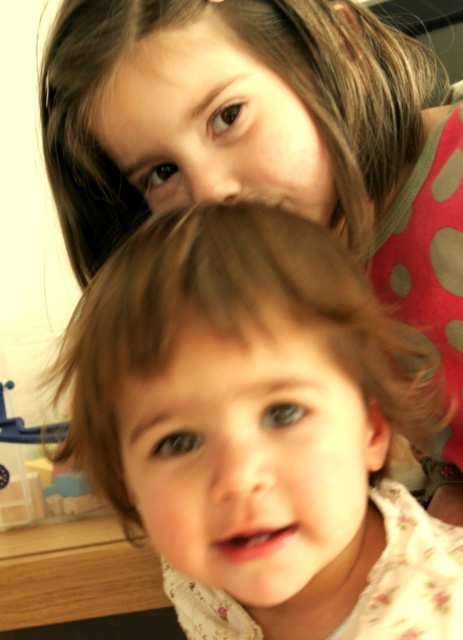
Can you confirm if fluffy brown hair at center is shorter than brown smooth hair at upper center?

Correct, fluffy brown hair at center is not as tall as brown smooth hair at upper center.

Can you confirm if fluffy brown hair at center is positioned above brown smooth hair at upper center?

No.

What do you see at coordinates (258, 429) in the screenshot? The height and width of the screenshot is (640, 463). I see `fluffy brown hair at center` at bounding box center [258, 429].

Locate an element on the screen. fluffy brown hair at center is located at coordinates (258, 429).